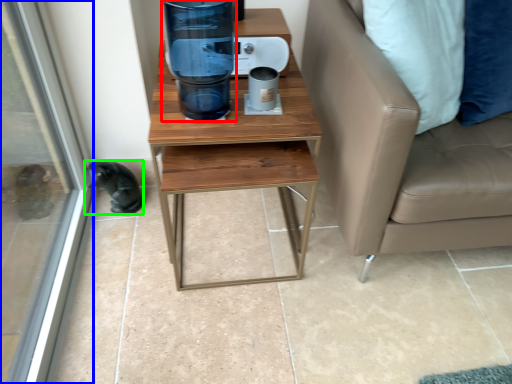
Question: Which object is positioned closest to water cooler (highlighted by a red box)? Select from screen door (highlighted by a blue box) and animal (highlighted by a green box).

Choices:
 (A) screen door
 (B) animal

Answer: (B)